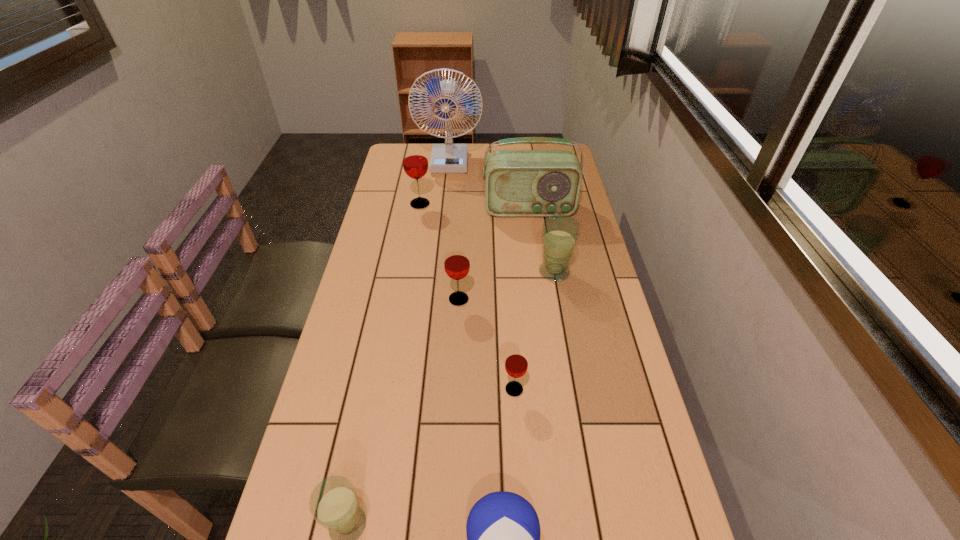
Locate an element on the screen. The height and width of the screenshot is (540, 960). radio receiver that is at the right edge is located at coordinates (518, 183).

You are a GUI agent. You are given a task and a screenshot of the screen. Output one action in this format:
    pyautogui.click(x=<x>, y=<y>)
    Task: Click on the glass that is at the right edge
    This screenshot has width=960, height=540.
    Given the screenshot: What is the action you would take?
    pyautogui.click(x=560, y=233)

At what (x,y) coordinates should I click in order to perform the action: click on object that is at the far left corner. Please return your answer as a coordinate pair (x, y). Looking at the image, I should click on (449, 158).

This screenshot has width=960, height=540. In the image, there is a desktop. What are the coordinates of `vacant region at the far edge` in the screenshot? It's located at (501, 150).

The width and height of the screenshot is (960, 540). I want to click on vacant space at the left edge, so click(410, 187).

The height and width of the screenshot is (540, 960). I want to click on blank space at the right edge of the desktop, so click(x=586, y=328).

In the image, there is a desktop. In order to click on vacant space at the far left corner in this screenshot , I will do `click(394, 146)`.

Locate an element on the screen. This screenshot has height=540, width=960. vacant space that's between the blue fan and the tallest glass is located at coordinates (435, 183).

Where is `vacant region between the third nearest glass and the right blue glass`? vacant region between the third nearest glass and the right blue glass is located at coordinates (507, 286).

Find the location of a particular element. This screenshot has height=540, width=960. vacant space that's between the smallest red glass and the fourth nearest glass is located at coordinates (534, 330).